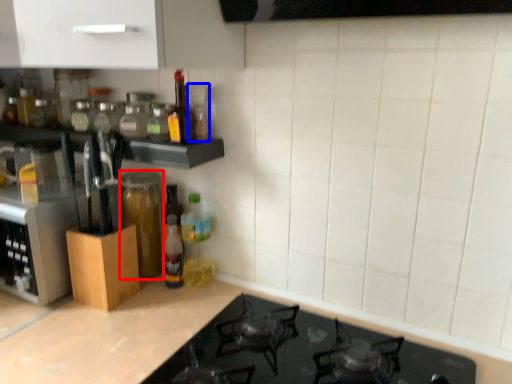
Question: Which of the following is the farthest to the observer, glass jar (highlighted by a red box) or bottle (highlighted by a blue box)?

Choices:
 (A) glass jar
 (B) bottle

Answer: (A)